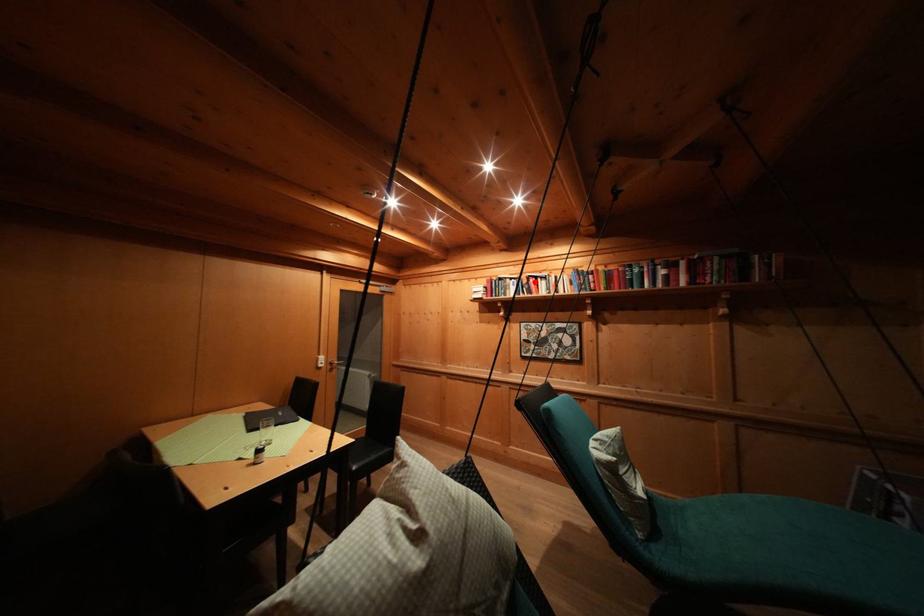
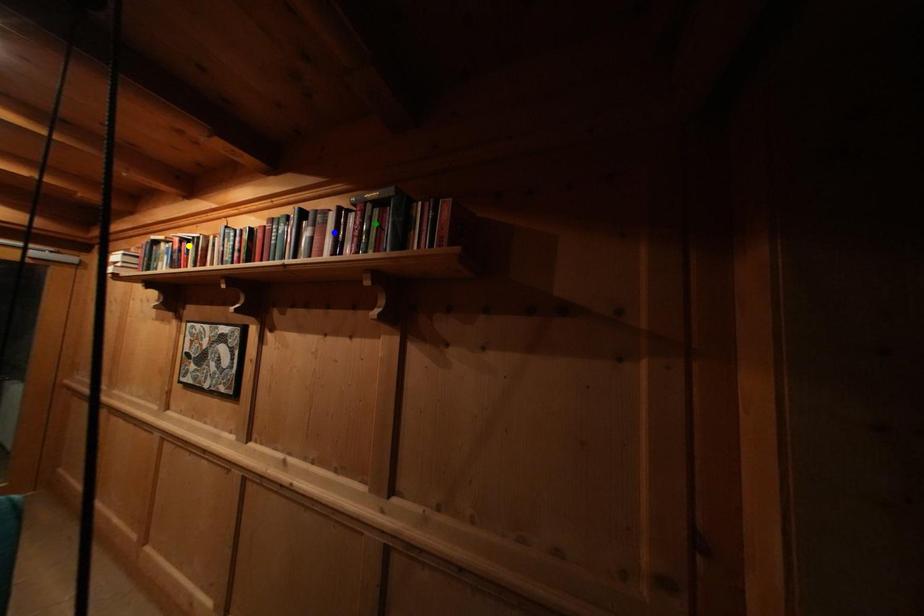
Question: I am providing you with two images of the same scene from different viewpoints. A red point is marked on the first image. You are given multiple points on the second image. Which mark in image 2 goes with the point in image 1?

Choices:
 (A) blue point
 (B) green point
 (C) yellow point

Answer: (C)